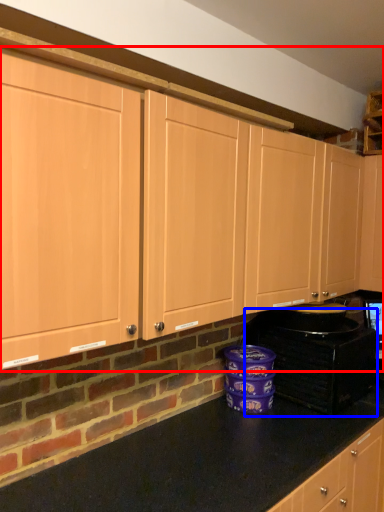
Question: Which of the following is the farthest to the observer, cabinetry (highlighted by a red box) or home appliance (highlighted by a blue box)?

Choices:
 (A) cabinetry
 (B) home appliance

Answer: (B)